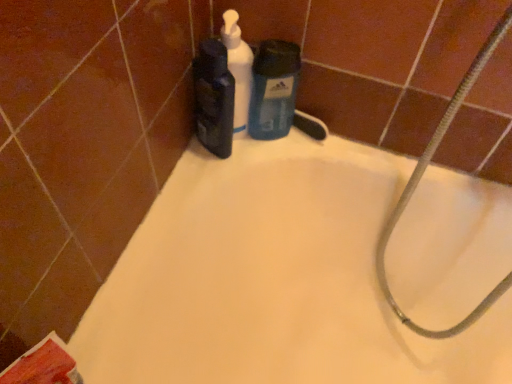
The height and width of the screenshot is (384, 512). I want to click on free spot in front of white matte pump bottle at upper center, which is counted as the second cleaning product, starting from the left, so click(193, 187).